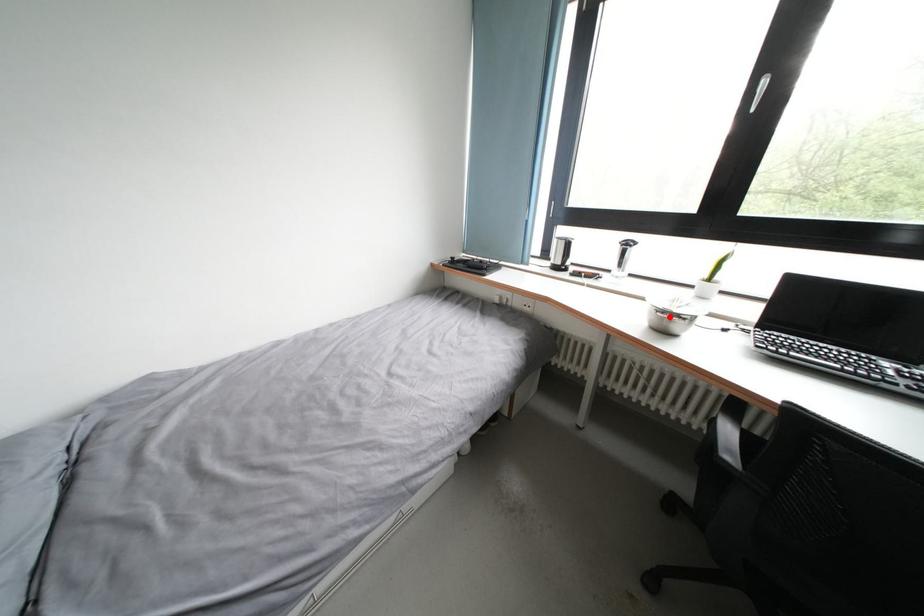
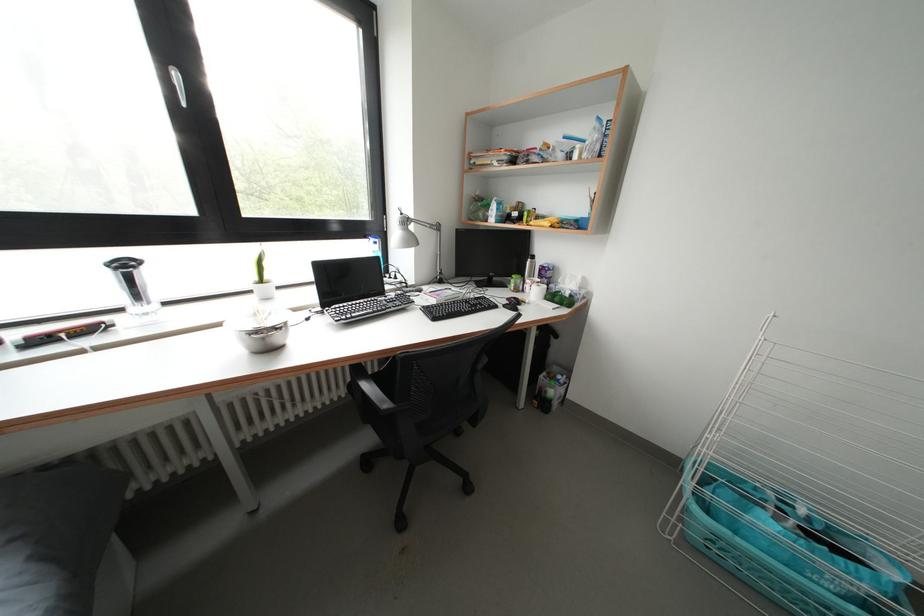
Locate, in the second image, the point that corresponds to the highlighted location in the first image.

(262, 337)